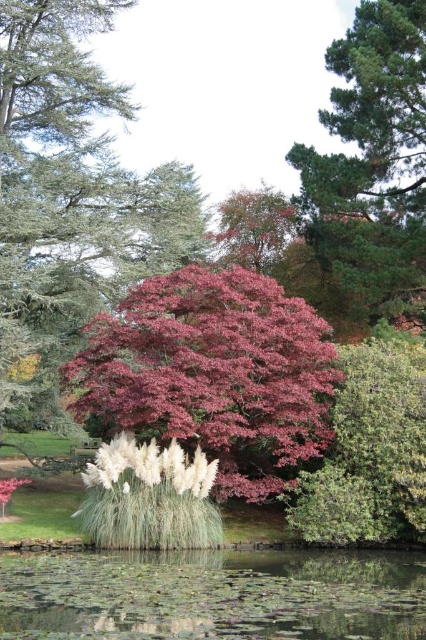
Is the position of pink glossy tree at center less distant than that of green textured bush at center?

No, it is behind green textured bush at center.

Between point (100, 179) and point (348, 416), which one is positioned behind?

The point (100, 179) is more distant.

Who is more forward, (x=48, y=138) or (x=396, y=358)?

Point (x=396, y=358) is more forward.

Identify the location of pink glossy tree at center. The width and height of the screenshot is (426, 640). (71, 198).

Is point (118, 307) farther from viewer compared to point (391, 392)?

Yes, point (118, 307) is farther from viewer.

Between purple glossy maple at center and green textured bush at center, which one is positioned lower?

purple glossy maple at center is below.

Is point (222, 467) closer to camera compared to point (394, 410)?

No, (222, 467) is further to viewer.

Locate an element on the screen. The image size is (426, 640). purple glossy maple at center is located at coordinates (213, 372).

Between point (117, 248) and point (342, 76), which one is positioned in front?

Point (117, 248)

Which is behind, point (57, 310) or point (391, 29)?

The point (391, 29) is behind.

Find the location of a particular element. pink glossy tree at center is located at coordinates (71, 198).